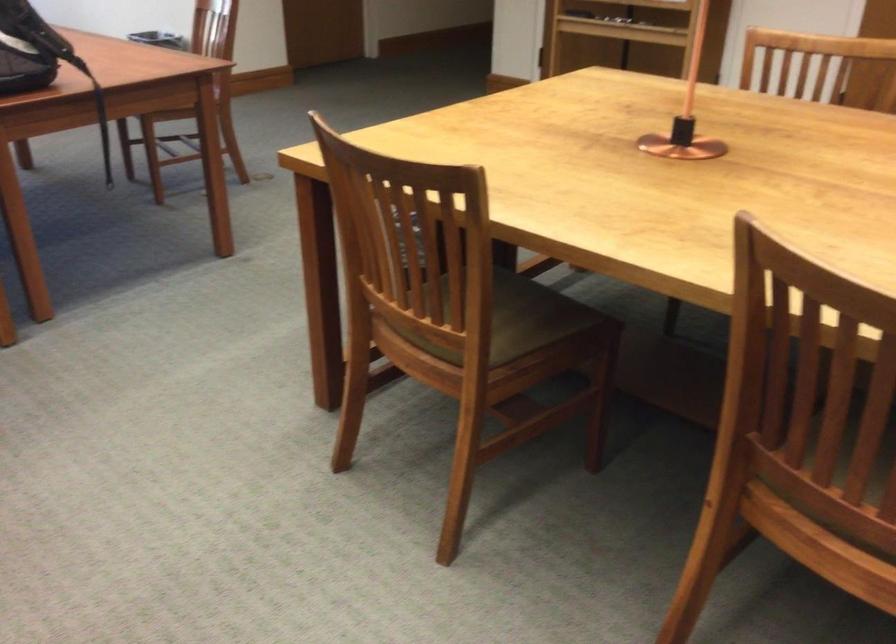
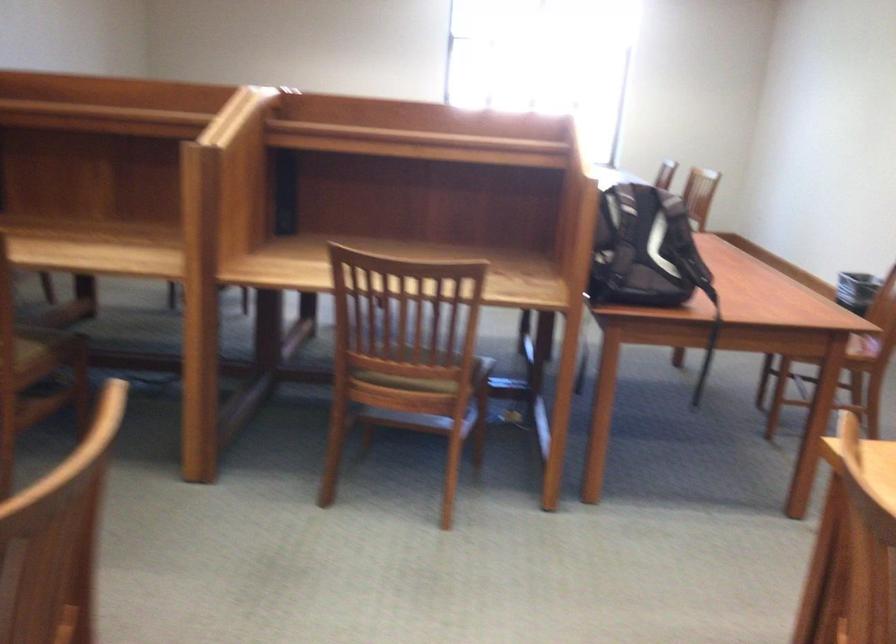
Question: The camera is either moving clockwise (left) or counter-clockwise (right) around the object. The first image is from the beginning of the video and the second image is from the end. Is the camera moving left or right when shooting the video?

Choices:
 (A) Left
 (B) Right

Answer: (B)